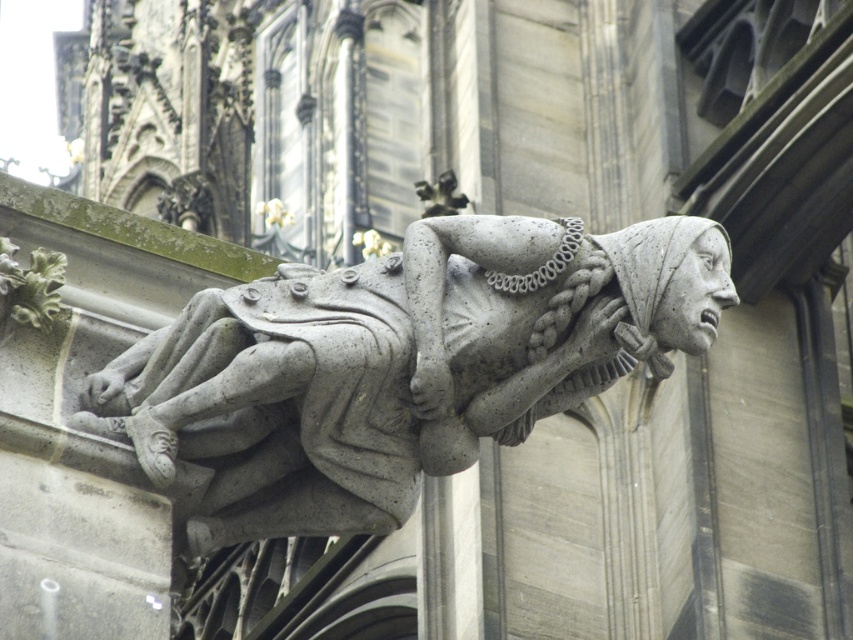
You are an architect designing a new cathedral and want to place a gray stone gargoyle at center. According to the image, what are the exact coordinates where you should position it?

The gray stone gargoyle at center should be positioned at coordinates [395,371].

You are an architect examining the stone gargoyle and want to determine the best position to install a small light. You have two points to choose from on the gargoyle sculpture. The first point is at coordinate point (538,248) and the second is at point (727,252). Which point is closer to you, and thus better for visibility?

Point (538,248) is closer to the viewer than point (727,252), so it would be better for visibility.

You are an architect examining the stone gargoyles on a cathedral facade. You notice two gargoyles, the gray stone gargoyle at center and the gray stone gargoyle at upper center. Which gargoyle is positioned to the left of the other?

The gray stone gargoyle at center is positioned to the left of the gray stone gargoyle at upper center.